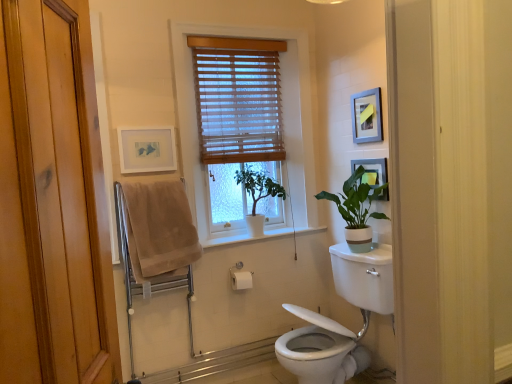
In order to face wooden blinds at center, should I rotate leftwards or rightwards?

To face it directly, rotate left by 1.277 degrees.

At what (x,y) coordinates should I click in order to perform the action: click on beige cotton bath towel at left. Please return your answer as a coordinate pair (x, y). Looking at the image, I should click on (159, 230).

This screenshot has height=384, width=512. What are the coordinates of `wooden blinds at center` in the screenshot? It's located at (238, 99).

This screenshot has width=512, height=384. Describe the element at coordinates (337, 322) in the screenshot. I see `white glossy toilet at lower right` at that location.

How much space does matte white picture frame at upper left, the 1th picture frame in the left-to-right sequence, occupy vertically?

matte white picture frame at upper left, the 1th picture frame in the left-to-right sequence, is 11.07 inches tall.

What do you see at coordinates (372, 171) in the screenshot?
I see `matte black picture frame at upper right, which is the 3th picture frame from left to right` at bounding box center [372, 171].

Image resolution: width=512 pixels, height=384 pixels. What are the coordinates of `green matte plant at upper right, the first houseplant from the right` in the screenshot? It's located at (357, 209).

Between silver metallic picture frame at upper right, the 2th picture frame viewed from the right, and green matte plant at center, the first houseplant positioned from the left, which one appears on the left side from the viewer's perspective?

green matte plant at center, the first houseplant positioned from the left, is more to the left.

Is silver metallic picture frame at upper right, positioned as the 2th picture frame in left-to-right order, in front of or behind green matte plant at center, which appears as the second houseplant when viewed from the right, in the image?

Clearly, silver metallic picture frame at upper right, positioned as the 2th picture frame in left-to-right order, is in front of green matte plant at center, which appears as the second houseplant when viewed from the right.

How distant is silver metallic picture frame at upper right, the 2th picture frame viewed from the right, from green matte plant at center, which appears as the second houseplant when viewed from the right?

A distance of 30.78 inches exists between silver metallic picture frame at upper right, the 2th picture frame viewed from the right, and green matte plant at center, which appears as the second houseplant when viewed from the right.

From a real-world perspective, is silver metallic picture frame at upper right, positioned as the 2th picture frame in left-to-right order, physically above green matte plant at center, the first houseplant positioned from the left?

Yes, from a real-world perspective, silver metallic picture frame at upper right, positioned as the 2th picture frame in left-to-right order, is on top of green matte plant at center, the first houseplant positioned from the left.

The image size is (512, 384). What are the coordinates of `the 2nd houseplant counting from the right side of the beige cotton bath towel at left` in the screenshot? It's located at (357, 209).

Is green matte plant at upper right, which is counted as the second houseplant, starting from the left, behind beige cotton bath towel at left?

Yes, it is behind beige cotton bath towel at left.

From their relative heights in the image, would you say green matte plant at upper right, which is counted as the second houseplant, starting from the left, is taller or shorter than beige cotton bath towel at left?

In the image, green matte plant at upper right, which is counted as the second houseplant, starting from the left, appears to be shorter than beige cotton bath towel at left.

Is point (370, 201) less distant than point (134, 192)?

That is False.

Does point (228, 137) appear closer or farther from the camera than point (387, 198)?

Point (228, 137).

Is wooden blinds at center oriented away from matte black picture frame at upper right, which is the 3th picture frame from left to right?

No, wooden blinds at center is not facing away from matte black picture frame at upper right, which is the 3th picture frame from left to right.

Considering the sizes of wooden blinds at center and matte black picture frame at upper right, which is the 3th picture frame from left to right, in the image, is wooden blinds at center bigger or smaller than matte black picture frame at upper right, which is the 3th picture frame from left to right,?

wooden blinds at center is bigger than matte black picture frame at upper right, which is the 3th picture frame from left to right.

From a real-world perspective, is wooden blinds at center above or below matte black picture frame at upper right, which is the 3th picture frame from left to right?

In terms of real-world spatial position, wooden blinds at center is above matte black picture frame at upper right, which is the 3th picture frame from left to right.

From the image's perspective, starting from the green matte plant at center, which appears as the second houseplant when viewed from the right, which picture frame is the 2nd one above? Please provide its 2D coordinates.

[(147, 149)]

Is green matte plant at center, the first houseplant positioned from the left, outside of matte white picture frame at upper left, the 1th picture frame in the left-to-right sequence?

green matte plant at center, the first houseplant positioned from the left, is positioned outside matte white picture frame at upper left, the 1th picture frame in the left-to-right sequence.

Which is closer to the camera, (263,175) or (140,163)?

Point (263,175) is positioned farther from the camera compared to point (140,163).

Where is `window blind above the green matte plant at center, which appears as the second houseplant when viewed from the right (from a real-world perspective)`? Image resolution: width=512 pixels, height=384 pixels. window blind above the green matte plant at center, which appears as the second houseplant when viewed from the right (from a real-world perspective) is located at coordinates point(238,99).

Can you tell me how much green matte plant at center, which appears as the second houseplant when viewed from the right, and wooden blinds at center differ in facing direction?

1.7 degrees separate the facing orientations of green matte plant at center, which appears as the second houseplant when viewed from the right, and wooden blinds at center.

Is wooden blinds at center inside green matte plant at center, which appears as the second houseplant when viewed from the right?

No.

Does green matte plant at center, the first houseplant positioned from the left, turn towards wooden blinds at center?

No, green matte plant at center, the first houseplant positioned from the left, is not oriented towards wooden blinds at center.

Who is taller, wooden blinds at center or white glossy toilet at lower right?

Standing taller between the two is white glossy toilet at lower right.

From a real-world perspective, relative to white glossy toilet at lower right, is wooden blinds at center vertically above or below?

In terms of real-world spatial position, wooden blinds at center is above white glossy toilet at lower right.

Is wooden blinds at center located outside white glossy toilet at lower right?

wooden blinds at center is positioned outside white glossy toilet at lower right.

You are a GUI agent. You are given a task and a screenshot of the screen. Output one action in this format:
    pyautogui.click(x=<x>, y=<y>)
    Task: Click on the window blind that appears above the white glossy toilet at lower right (from the image's perspective)
    This screenshot has width=512, height=384.
    Given the screenshot: What is the action you would take?
    pyautogui.click(x=238, y=99)

From a real-world perspective, does matte black picture frame at upper right, placed as the first picture frame when sorted from right to left, stand above green matte plant at center, the first houseplant positioned from the left?

Yes.

Considering the points (361, 181) and (255, 192), which point is behind, point (361, 181) or point (255, 192)?

The point (255, 192) is farther from the camera.

Does matte black picture frame at upper right, placed as the first picture frame when sorted from right to left, have a lesser width compared to green matte plant at center, which appears as the second houseplant when viewed from the right?

Indeed, matte black picture frame at upper right, placed as the first picture frame when sorted from right to left, has a lesser width compared to green matte plant at center, which appears as the second houseplant when viewed from the right.

This screenshot has height=384, width=512. In order to click on the 1st houseplant directly beneath the matte black picture frame at upper right, which is the 3th picture frame from left to right (from a real-world perspective) in this screenshot , I will do `click(258, 194)`.

What are the coordinates of `the 3rd picture frame positioned above the green matte plant at center, the first houseplant positioned from the left (from a real-world perspective)` in the screenshot? It's located at (367, 116).

This screenshot has width=512, height=384. I want to click on the 2nd houseplant to the right when counting from the beige cotton bath towel at left, so click(x=357, y=209).

Looking at the image, which one is located closer to matte black picture frame at upper right, which is the 3th picture frame from left to right, wooden blinds at center or green matte plant at upper right, which is counted as the second houseplant, starting from the left?

Among the two, green matte plant at upper right, which is counted as the second houseplant, starting from the left, is located nearer to matte black picture frame at upper right, which is the 3th picture frame from left to right.

In the scene shown: When comparing their distances from matte black picture frame at upper right, placed as the first picture frame when sorted from right to left, does silver metallic picture frame at upper right, the 2th picture frame viewed from the right, or white glossy toilet at lower right seem closer?

Based on the image, silver metallic picture frame at upper right, the 2th picture frame viewed from the right, appears to be nearer to matte black picture frame at upper right, placed as the first picture frame when sorted from right to left.

Which object lies nearer to the anchor point white glossy toilet at lower right, matte black picture frame at upper right, placed as the first picture frame when sorted from right to left, or green matte plant at center, which appears as the second houseplant when viewed from the right?

Among the two, matte black picture frame at upper right, placed as the first picture frame when sorted from right to left, is located nearer to white glossy toilet at lower right.

Looking at the image, which one is located further to matte white picture frame at upper left, positioned as the 3th picture frame in right-to-left order, wooden blinds at center or silver metallic picture frame at upper right, positioned as the 2th picture frame in left-to-right order?

Based on the image, silver metallic picture frame at upper right, positioned as the 2th picture frame in left-to-right order, appears to be further to matte white picture frame at upper left, positioned as the 3th picture frame in right-to-left order.

Looking at this image, from the image, which object appears to be nearer to matte white picture frame at upper left, positioned as the 3th picture frame in right-to-left order, wooden blinds at center or green matte plant at center, which appears as the second houseplant when viewed from the right?

wooden blinds at center lies closer to matte white picture frame at upper left, positioned as the 3th picture frame in right-to-left order, than the other object.

Based on the photo, estimate the real-world distances between objects in this image. Which object is closer to white glossy toilet at lower right, silver metallic picture frame at upper right, the 2th picture frame viewed from the right, or green matte plant at center, which appears as the second houseplant when viewed from the right?

green matte plant at center, which appears as the second houseplant when viewed from the right, is positioned closer to the anchor white glossy toilet at lower right.

From the picture: Estimate the real-world distances between objects in this image. Which object is further from matte white picture frame at upper left, the 1th picture frame in the left-to-right sequence, wooden blinds at center or white glossy toilet at lower right?

The object further to matte white picture frame at upper left, the 1th picture frame in the left-to-right sequence, is white glossy toilet at lower right.

Estimate the real-world distances between objects in this image. Which object is further from beige cotton bath towel at left, white glossy toilet at lower right or wooden blinds at center?

white glossy toilet at lower right is positioned further to the anchor beige cotton bath towel at left.

Find the location of a particular element. sink situated between matte white picture frame at upper left, the 1th picture frame in the left-to-right sequence, and silver metallic picture frame at upper right, positioned as the 2th picture frame in left-to-right order, from left to right is located at coordinates (337, 322).

Image resolution: width=512 pixels, height=384 pixels. I want to click on window blind between matte white picture frame at upper left, positioned as the 3th picture frame in right-to-left order, and silver metallic picture frame at upper right, positioned as the 2th picture frame in left-to-right order, from left to right, so click(238, 99).

At what (x,y) coordinates should I click in order to perform the action: click on picture frame situated between wooden blinds at center and matte black picture frame at upper right, placed as the first picture frame when sorted from right to left, from left to right. Please return your answer as a coordinate pair (x, y). The width and height of the screenshot is (512, 384). Looking at the image, I should click on (367, 116).

I want to click on window blind between beige cotton bath towel at left and matte black picture frame at upper right, placed as the first picture frame when sorted from right to left, so pos(238,99).